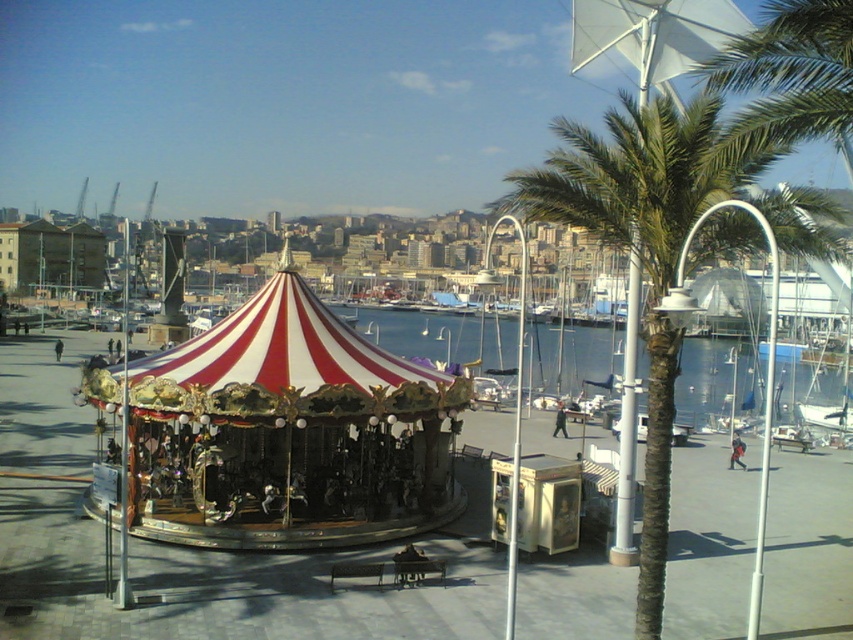
Question: Is red and white striped canopy at center below white water at center?

Choices:
 (A) yes
 (B) no

Answer: (A)

Question: Can you confirm if green leafy palm tree at center is thinner than red and white striped canopy at center?

Choices:
 (A) no
 (B) yes

Answer: (A)

Question: Which point is farther to the camera?

Choices:
 (A) (126, 524)
 (B) (741, 365)

Answer: (B)

Question: Can you confirm if green leafy palm tree at center is thinner than red and white striped canopy at center?

Choices:
 (A) yes
 (B) no

Answer: (B)

Question: Which point is farther to the camera?

Choices:
 (A) (245, 342)
 (B) (489, 360)
 (C) (663, 440)
 (D) (119, 413)

Answer: (B)

Question: Which of the following is the farthest from the observer?

Choices:
 (A) (194, 404)
 (B) (123, 328)
 (C) (669, 276)
 (D) (734, 394)

Answer: (B)